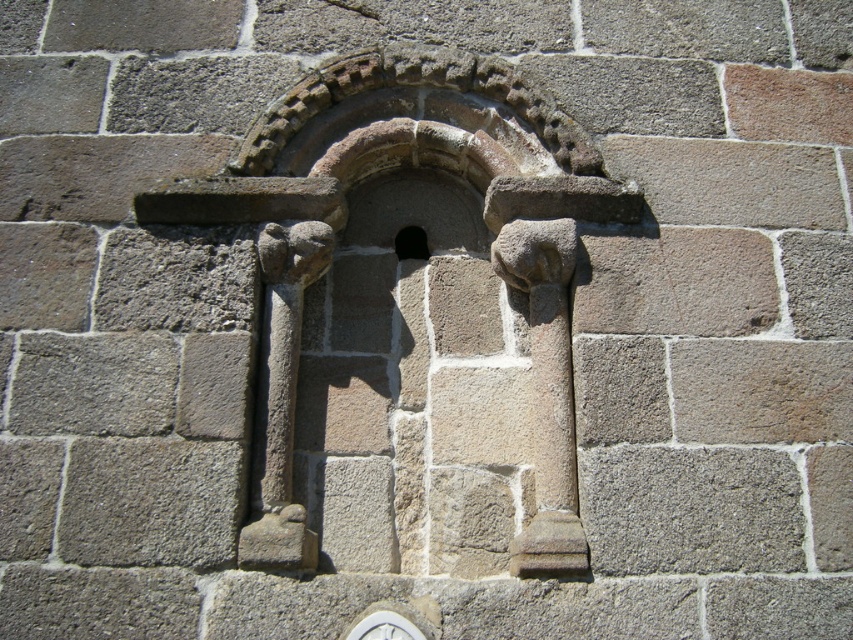
The image size is (853, 640). I want to click on rustic stone arch at center, so click(344, 224).

Is point (535, 353) farther from viewer compared to point (398, 234)?

No, (535, 353) is in front of (398, 234).

Measure the distance between rustic stone arch at center and camera.

rustic stone arch at center and camera are 12.70 meters apart.

Where is `rustic stone arch at center`? The width and height of the screenshot is (853, 640). rustic stone arch at center is located at coordinates (344, 224).